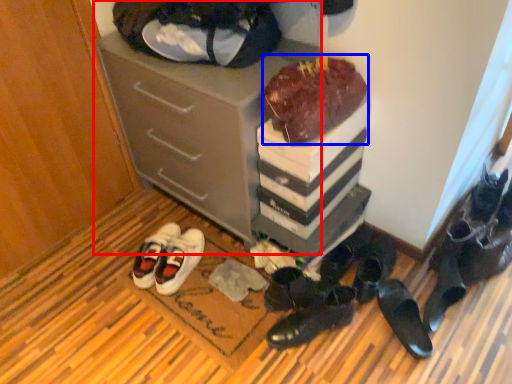
Question: Among these objects, which one is nearest to the camera, cabinetry (highlighted by a red box) or chocolate cake (highlighted by a blue box)?

Choices:
 (A) cabinetry
 (B) chocolate cake

Answer: (B)